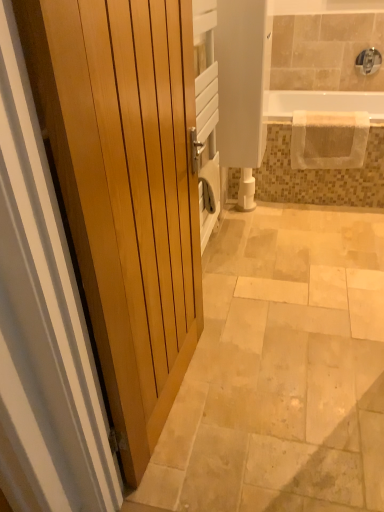
Question: Is silver metallic faucet at upper right at the left side of white glossy toilet paper at center?

Choices:
 (A) yes
 (B) no

Answer: (B)

Question: Can you confirm if silver metallic faucet at upper right is taller than white glossy toilet paper at center?

Choices:
 (A) yes
 (B) no

Answer: (B)

Question: Is silver metallic faucet at upper right positioned far away from white glossy toilet paper at center?

Choices:
 (A) no
 (B) yes

Answer: (B)

Question: Is silver metallic faucet at upper right facing towards white glossy toilet paper at center?

Choices:
 (A) no
 (B) yes

Answer: (A)

Question: From a real-world perspective, is silver metallic faucet at upper right located higher than white glossy toilet paper at center?

Choices:
 (A) no
 (B) yes

Answer: (B)

Question: Does point (246, 184) appear closer or farther from the camera than point (192, 334)?

Choices:
 (A) farther
 (B) closer

Answer: (A)

Question: Relative to light wood door at left, is white glossy toilet paper at center in front or behind?

Choices:
 (A) front
 (B) behind

Answer: (B)

Question: From the image's perspective, is white glossy toilet paper at center positioned above or below light wood door at left?

Choices:
 (A) below
 (B) above

Answer: (B)

Question: Do you think white glossy toilet paper at center is within light wood door at left, or outside of it?

Choices:
 (A) outside
 (B) inside

Answer: (A)

Question: In terms of height, does beige textured towel at upper right look taller or shorter compared to silver metallic faucet at upper right?

Choices:
 (A) short
 (B) tall

Answer: (B)

Question: Considering the positions of beige textured towel at upper right and silver metallic faucet at upper right in the image, is beige textured towel at upper right bigger or smaller than silver metallic faucet at upper right?

Choices:
 (A) small
 (B) big

Answer: (B)

Question: Which is correct: beige textured towel at upper right is inside silver metallic faucet at upper right, or outside of it?

Choices:
 (A) inside
 (B) outside

Answer: (B)

Question: From the image's perspective, is beige textured towel at upper right positioned above or below silver metallic faucet at upper right?

Choices:
 (A) below
 (B) above

Answer: (A)

Question: Is point (238, 207) positioned closer to the camera than point (327, 144)?

Choices:
 (A) closer
 (B) farther

Answer: (B)

Question: From the image's perspective, relative to beige textured towel at upper right, is white glossy toilet paper at center above or below?

Choices:
 (A) below
 (B) above

Answer: (A)